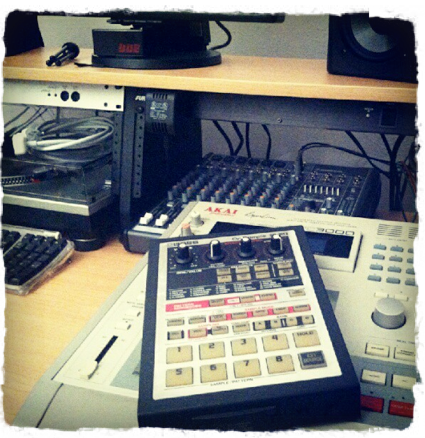
The width and height of the screenshot is (425, 438). I want to click on white switch, so click(143, 220), click(158, 221).